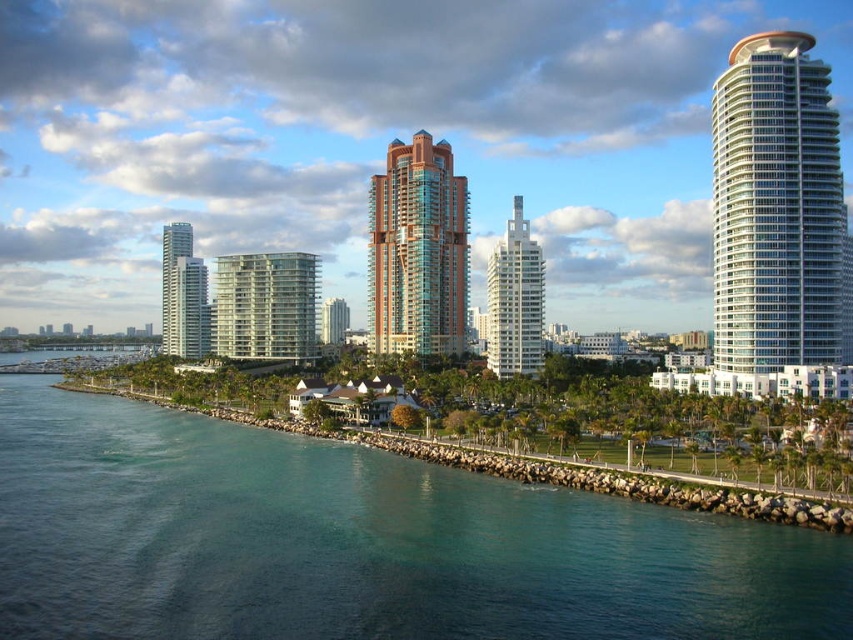
Does white glassy tower at right have a lesser width compared to teal glass tower at center?

No, white glassy tower at right is not thinner than teal glass tower at center.

Can you confirm if white glassy tower at right is positioned above teal glass tower at center?

Yes.

Is point (766, 368) positioned before point (393, 301)?

Yes, it is in front of point (393, 301).

The width and height of the screenshot is (853, 640). In order to click on white glassy tower at right in this screenshot , I will do `click(775, 208)`.

Which is more to the left, clear glass building at center or white glass building at center?

From the viewer's perspective, clear glass building at center appears more on the left side.

Is point (234, 326) positioned after point (490, 291)?

Yes, it is behind point (490, 291).

Which is in front, point (257, 291) or point (531, 275)?

Point (531, 275)

At what (x,y) coordinates should I click in order to perform the action: click on clear glass building at center. Please return your answer as a coordinate pair (x, y). Looking at the image, I should click on (264, 307).

Where is `white glassy tower at right`? The height and width of the screenshot is (640, 853). white glassy tower at right is located at coordinates (775, 208).

Can you confirm if white glassy tower at right is positioned above glassy white skyscraper at left?

Yes.

Does point (751, 289) come behind point (186, 276)?

No.

Where is `white glassy tower at right`? white glassy tower at right is located at coordinates (775, 208).